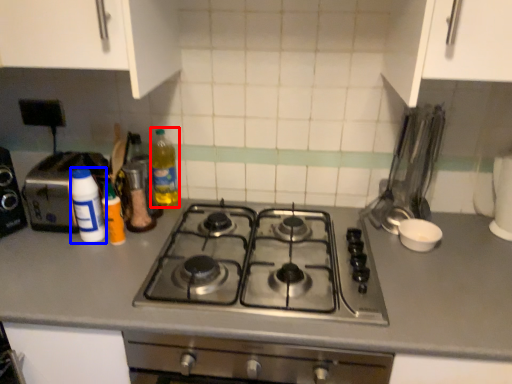
Question: Which object appears closest to the camera in this image, bottle (highlighted by a red box) or bottle (highlighted by a blue box)?

Choices:
 (A) bottle
 (B) bottle

Answer: (B)